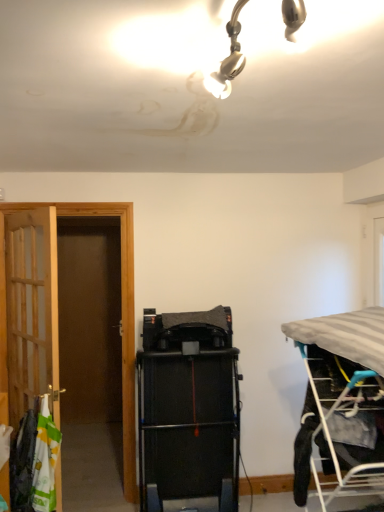
Question: Is white fabric laundry at left inside or outside of black rubber treadmill at center?

Choices:
 (A) inside
 (B) outside

Answer: (B)

Question: From the image's perspective, is white fabric laundry at left above or below black rubber treadmill at center?

Choices:
 (A) above
 (B) below

Answer: (B)

Question: Estimate the real-world distances between objects in this image. Which object is farther from the wooden door at left?

Choices:
 (A) white fabric laundry at left
 (B) black rubber treadmill at center
 (C) gray fabric bed at right

Answer: (C)

Question: Based on their relative distances, which object is farther from the wooden door at left?

Choices:
 (A) gray fabric bed at right
 (B) white fabric laundry at left
 (C) black rubber treadmill at center

Answer: (A)